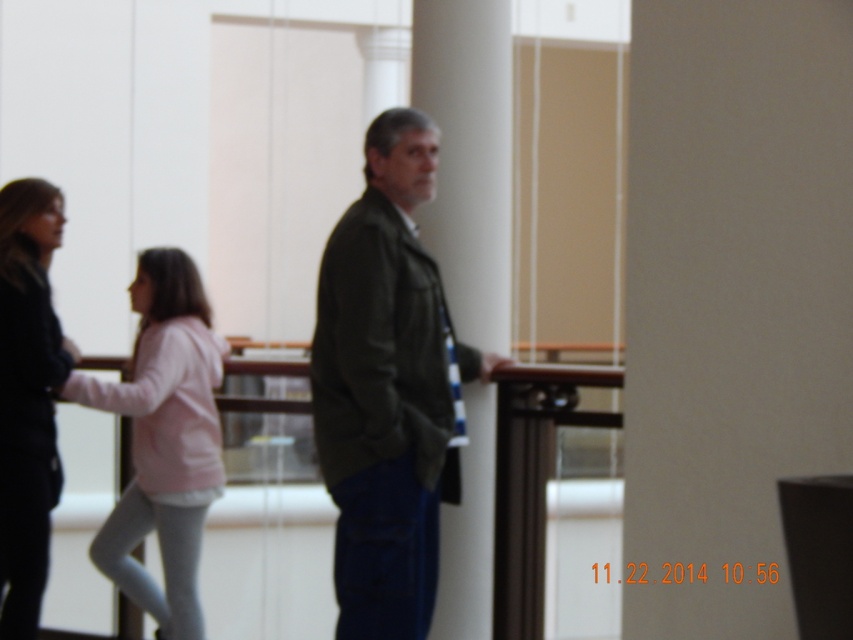
You are standing at the entrance of the building and want to walk towards the railing. There is a white smooth pillar at center and a pink fleece jacket at center in your path. Which object will you need to navigate around first?

The white smooth pillar at center occupies less space than the pink fleece jacket at center, so you will need to navigate around the pink fleece jacket at center first as it takes up more space in your path.

You are standing at the entrance of the building and want to find the person wearing the dark green jacket at center. According to the scene description, where should you look relative to the white smooth pillar at center?

The dark green jacket at center is below the white smooth pillar at center, so you should look downward from the pillar to find the person wearing the dark green jacket at center.

You are an interior designer assessing the space between the dark green jacket at center and the white smooth pillar at center. If you want to place a 1.2 meter wide sofa between them, will it fit?

The dark green jacket at center is wider than the white smooth pillar at center, but the exact distance between them isn